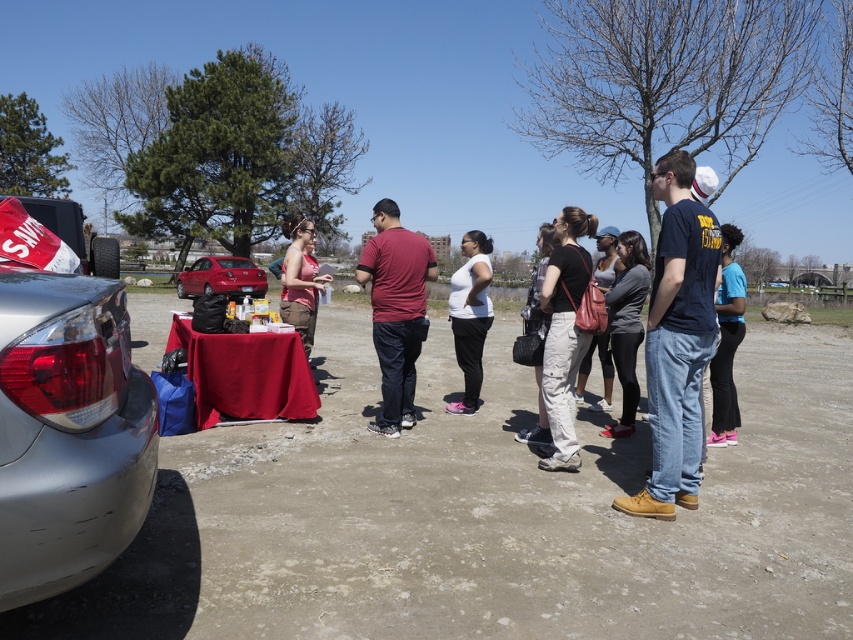
You are standing at the position of the white matte shirt at center and want to retrieve an item from the silver metallic car at left. Considering the distance between them, can you comfortably reach the car without moving from your current position?

The silver metallic car at left is 4.42 meters away from the white matte shirt at center. Since the distance is quite far, you cannot comfortably reach the car without moving from your current position.

Looking at this image, you are standing at the edge of the scene and want to hand a flyer to both the person wearing the matte black shirt at center and the white matte shirt at center. If you can reach 5 feet, will you be able to hand both flyers without moving closer?

The matte black shirt at center is 5.34 feet away from the white matte shirt at center. Since your reach is 5 feet, you cannot hand both flyers without moving closer because the distance between them exceeds your reach.

You are standing in the middle of the scene and want to move towards the silver metallic car at left. Which direction should you move in relation to the white matte shirt at center?

The silver metallic car at left is located above the white matte shirt at center, so you should move upwards from the white matte shirt at center to reach the silver metallic car at left.